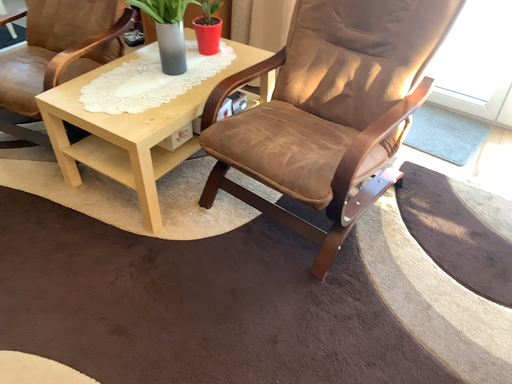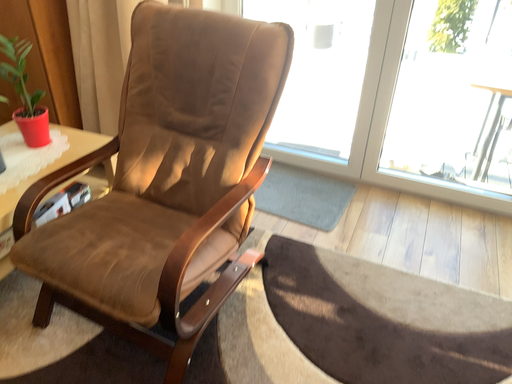
Question: How did the camera likely rotate when shooting the video?

Choices:
 (A) rotated right
 (B) rotated left

Answer: (A)